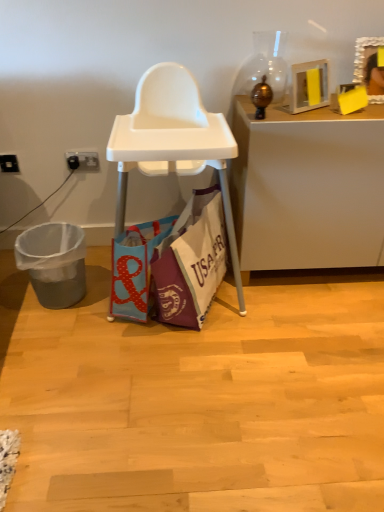
Identify the location of free location in front of gray plastic trash can at lower left. This screenshot has height=512, width=384. (58, 334).